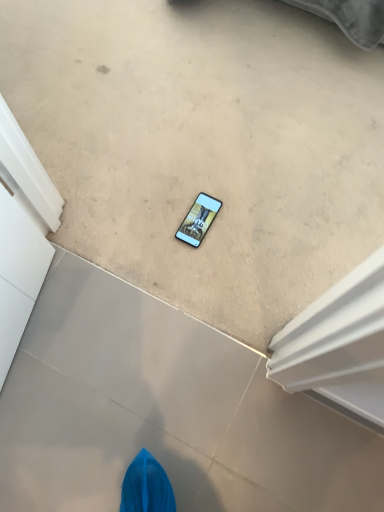
This screenshot has height=512, width=384. What do you see at coordinates (198, 220) in the screenshot?
I see `matte black phone at center` at bounding box center [198, 220].

You are a GUI agent. You are given a task and a screenshot of the screen. Output one action in this format:
    pyautogui.click(x=<x>, y=<y>)
    Task: Click on the beige carpet at center, which is the second concrete from bottom to top
    The width and height of the screenshot is (384, 512).
    Given the screenshot: What is the action you would take?
    click(204, 146)

Find the location of `concrete above the matte black phone at center (from a real-world perspective)`. concrete above the matte black phone at center (from a real-world perspective) is located at coordinates (204, 146).

Which object is more forward, beige carpet at center, acting as the 1th concrete starting from the top, or matte black phone at center?

beige carpet at center, acting as the 1th concrete starting from the top, is more forward.

From the image's perspective, who appears lower, beige carpet at center, acting as the 1th concrete starting from the top, or matte black phone at center?

From the image's view, matte black phone at center is below.

Is beige carpet at center, acting as the 1th concrete starting from the top, next to matte black phone at center and touching it?

beige carpet at center, acting as the 1th concrete starting from the top, and matte black phone at center are not in contact.

Between point (128, 335) and point (192, 212), which one is positioned in front?

The point (128, 335) is in front.

Which is more to the left, matte gray concrete at center, the 2th concrete in the top-to-bottom sequence, or matte black phone at center?

From the viewer's perspective, matte gray concrete at center, the 2th concrete in the top-to-bottom sequence, appears more on the left side.

From the image's perspective, is matte gray concrete at center, the 2th concrete in the top-to-bottom sequence, above matte black phone at center?

Actually, matte gray concrete at center, the 2th concrete in the top-to-bottom sequence, appears below matte black phone at center in the image.

Is matte gray concrete at center, the first concrete ordered from the bottom, positioned beyond the bounds of matte black phone at center?

Indeed, matte gray concrete at center, the first concrete ordered from the bottom, is completely outside matte black phone at center.

Can you tell me how much matte black phone at center and beige carpet at center, which is the second concrete from bottom to top, differ in facing direction?

matte black phone at center and beige carpet at center, which is the second concrete from bottom to top, are facing 178 degrees away from each other.

In the image, there is a beige carpet at center, which is the second concrete from bottom to top. At what (x,y) coordinates should I click in order to perform the action: click on mobile phone below it (from a real-world perspective). Please return your answer as a coordinate pair (x, y). Looking at the image, I should click on (198, 220).

Considering the positions of objects matte black phone at center and beige carpet at center, acting as the 1th concrete starting from the top, in the image provided, who is more to the left, matte black phone at center or beige carpet at center, acting as the 1th concrete starting from the top,?

Positioned to the left is beige carpet at center, acting as the 1th concrete starting from the top.

From the image's perspective, is matte black phone at center located above or below beige carpet at center, which is the second concrete from bottom to top?

matte black phone at center is below beige carpet at center, which is the second concrete from bottom to top.

Does beige carpet at center, which is the second concrete from bottom to top, have a lesser width compared to matte gray concrete at center, the 2th concrete in the top-to-bottom sequence?

No.

Find the location of a particular element. The height and width of the screenshot is (512, 384). concrete below the beige carpet at center, acting as the 1th concrete starting from the top (from the image's perspective) is located at coordinates (163, 411).

Which is closer, [158,40] or [132,311]?

Point [158,40] appears to be farther away from the viewer than point [132,311].

Is the position of beige carpet at center, acting as the 1th concrete starting from the top, less distant than that of matte gray concrete at center, the 2th concrete in the top-to-bottom sequence?

No, the depth of beige carpet at center, acting as the 1th concrete starting from the top, is greater than that of matte gray concrete at center, the 2th concrete in the top-to-bottom sequence.

Can you confirm if matte black phone at center is shorter than matte gray concrete at center, the 2th concrete in the top-to-bottom sequence?

Indeed, matte black phone at center has a lesser height compared to matte gray concrete at center, the 2th concrete in the top-to-bottom sequence.

Would you consider matte black phone at center to be distant from matte gray concrete at center, the first concrete ordered from the bottom?

No, there isn't a large distance between matte black phone at center and matte gray concrete at center, the first concrete ordered from the bottom.

How different are the orientations of matte black phone at center and matte gray concrete at center, the first concrete ordered from the bottom, in degrees?

matte black phone at center and matte gray concrete at center, the first concrete ordered from the bottom, are facing 1.9 degrees away from each other.

From a real-world perspective, is matte black phone at center physically below matte gray concrete at center, the 2th concrete in the top-to-bottom sequence?

No, from a real-world perspective, matte black phone at center is not beneath matte gray concrete at center, the 2th concrete in the top-to-bottom sequence.

From the image's perspective, between matte gray concrete at center, the 2th concrete in the top-to-bottom sequence, and beige carpet at center, acting as the 1th concrete starting from the top, who is located below?

matte gray concrete at center, the 2th concrete in the top-to-bottom sequence, from the image's perspective.

Can beige carpet at center, which is the second concrete from bottom to top, be found inside matte gray concrete at center, the first concrete ordered from the bottom?

Actually, beige carpet at center, which is the second concrete from bottom to top, is outside matte gray concrete at center, the first concrete ordered from the bottom.

How many degrees apart are the facing directions of matte gray concrete at center, the 2th concrete in the top-to-bottom sequence, and beige carpet at center, acting as the 1th concrete starting from the top?

The facing directions of matte gray concrete at center, the 2th concrete in the top-to-bottom sequence, and beige carpet at center, acting as the 1th concrete starting from the top, are 180 degrees apart.

From a real-world perspective, is matte gray concrete at center, the first concrete ordered from the bottom, positioned above or below beige carpet at center, which is the second concrete from bottom to top?

matte gray concrete at center, the first concrete ordered from the bottom, is below beige carpet at center, which is the second concrete from bottom to top.

This screenshot has width=384, height=512. I want to click on mobile phone on the right side of beige carpet at center, acting as the 1th concrete starting from the top, so click(x=198, y=220).

Image resolution: width=384 pixels, height=512 pixels. In order to click on the 2nd concrete in front of the matte black phone at center, starting your count from the anchor in this screenshot , I will do `click(163, 411)`.

When comparing their distances from beige carpet at center, which is the second concrete from bottom to top, does matte gray concrete at center, the first concrete ordered from the bottom, or matte black phone at center seem further?

matte gray concrete at center, the first concrete ordered from the bottom, is further to beige carpet at center, which is the second concrete from bottom to top.

Based on their spatial positions, is beige carpet at center, acting as the 1th concrete starting from the top, or matte black phone at center closer to matte gray concrete at center, the 2th concrete in the top-to-bottom sequence?

beige carpet at center, acting as the 1th concrete starting from the top, is positioned closer to the anchor matte gray concrete at center, the 2th concrete in the top-to-bottom sequence.

Considering their positions, is matte black phone at center positioned closer to matte gray concrete at center, the 2th concrete in the top-to-bottom sequence, than beige carpet at center, acting as the 1th concrete starting from the top?

beige carpet at center, acting as the 1th concrete starting from the top, is positioned closer to the anchor matte gray concrete at center, the 2th concrete in the top-to-bottom sequence.

Consider the image. From the image, which object appears to be nearer to matte black phone at center, matte gray concrete at center, the 2th concrete in the top-to-bottom sequence, or beige carpet at center, which is the second concrete from bottom to top?

Among the two, beige carpet at center, which is the second concrete from bottom to top, is located nearer to matte black phone at center.

Looking at this image, looking at the image, which one is located closer to beige carpet at center, which is the second concrete from bottom to top, matte black phone at center or matte gray concrete at center, the 2th concrete in the top-to-bottom sequence?

matte black phone at center lies closer to beige carpet at center, which is the second concrete from bottom to top, than the other object.

When comparing their distances from matte black phone at center, does beige carpet at center, which is the second concrete from bottom to top, or matte gray concrete at center, the first concrete ordered from the bottom, seem further?

matte gray concrete at center, the first concrete ordered from the bottom, is further to matte black phone at center.

Image resolution: width=384 pixels, height=512 pixels. What are the coordinates of `mobile phone between beige carpet at center, acting as the 1th concrete starting from the top, and matte gray concrete at center, the first concrete ordered from the bottom, in the vertical direction` in the screenshot? It's located at (198, 220).